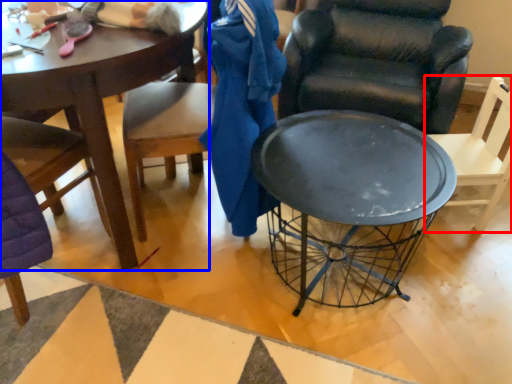
Question: Which of the following is the farthest to the observer, chair (highlighted by a red box) or coffee table (highlighted by a blue box)?

Choices:
 (A) chair
 (B) coffee table

Answer: (A)